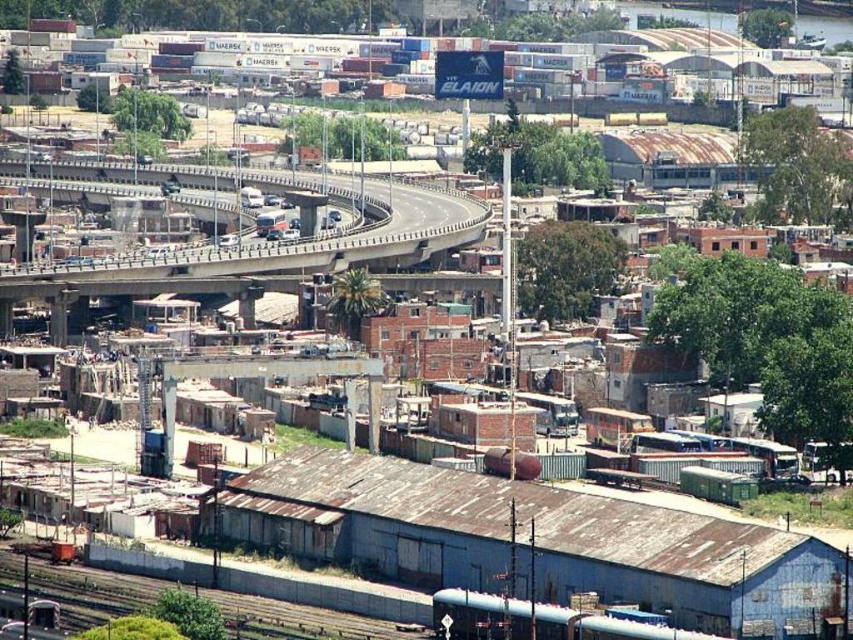
Does concrete bridge at upper center appear under rusty metal train track at lower left?

No, concrete bridge at upper center is not below rusty metal train track at lower left.

This screenshot has width=853, height=640. What do you see at coordinates (257, 241) in the screenshot?
I see `concrete bridge at upper center` at bounding box center [257, 241].

Describe the element at coordinates (257, 241) in the screenshot. The height and width of the screenshot is (640, 853). I see `concrete bridge at upper center` at that location.

This screenshot has width=853, height=640. In order to click on concrete bridge at upper center in this screenshot , I will do `click(257, 241)`.